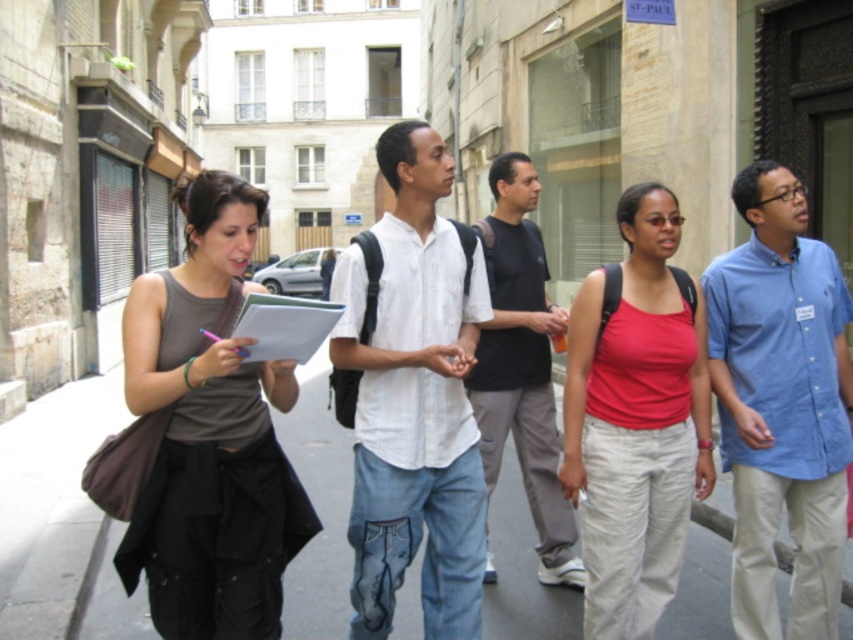
Is point (439, 252) in front of point (699, 448)?

Yes, point (439, 252) is in front of point (699, 448).

Looking at this image, between white cotton shirt at center and matte red tank top at center, which one is positioned lower?

matte red tank top at center is lower down.

Between point (347, 260) and point (645, 189), which one is positioned behind?

The point (645, 189) is more distant.

You are a GUI agent. You are given a task and a screenshot of the screen. Output one action in this format:
    pyautogui.click(x=<x>, y=<y>)
    Task: Click on the white cotton shirt at center
    The width and height of the screenshot is (853, 640).
    Given the screenshot: What is the action you would take?
    pyautogui.click(x=415, y=401)

Does matte gray tank top at center have a smaller size compared to white cotton shirt at center?

Incorrect, matte gray tank top at center is not smaller in size than white cotton shirt at center.

Does matte gray tank top at center have a greater width compared to white cotton shirt at center?

Yes.

Measure the distance between matte gray tank top at center and camera.

They are 8.37 feet apart.

Locate an element on the screen. matte gray tank top at center is located at coordinates (209, 435).

Where is `matte gray tank top at center`? The width and height of the screenshot is (853, 640). matte gray tank top at center is located at coordinates coord(209,435).

Is point (204, 248) farther from viewer compared to point (630, 582)?

No, (204, 248) is in front of (630, 582).

Which is behind, point (254, 522) or point (643, 182)?

Point (643, 182)

Where is `matte gray tank top at center`? The height and width of the screenshot is (640, 853). matte gray tank top at center is located at coordinates (209, 435).